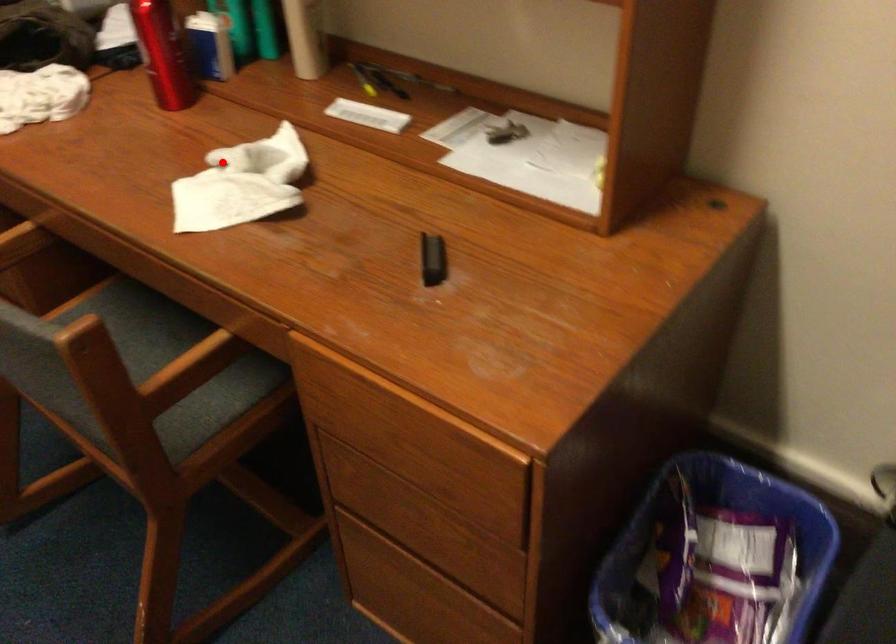
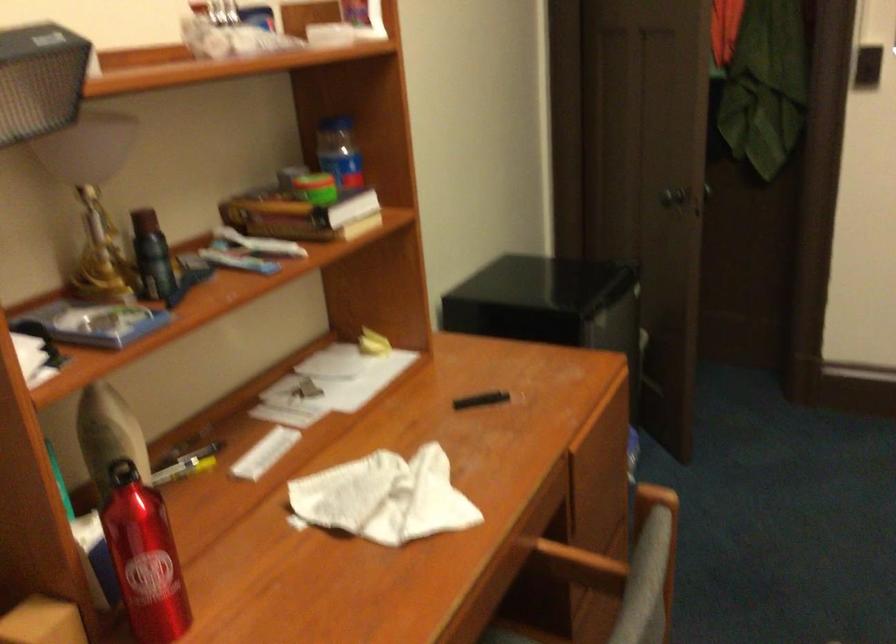
Find the pixel in the second image that matches the highlighted location in the first image.

(383, 498)